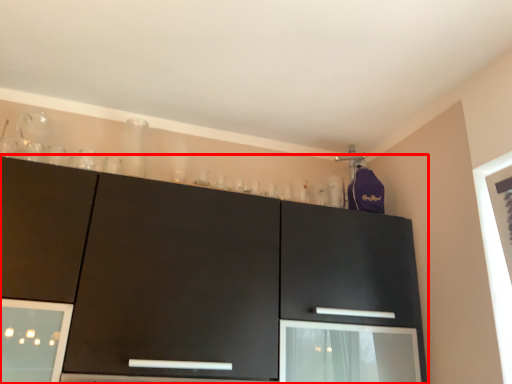
Question: From the image's perspective, where is cabinetry (annotated by the red box) located relative to screen door?

Choices:
 (A) below
 (B) above

Answer: (B)